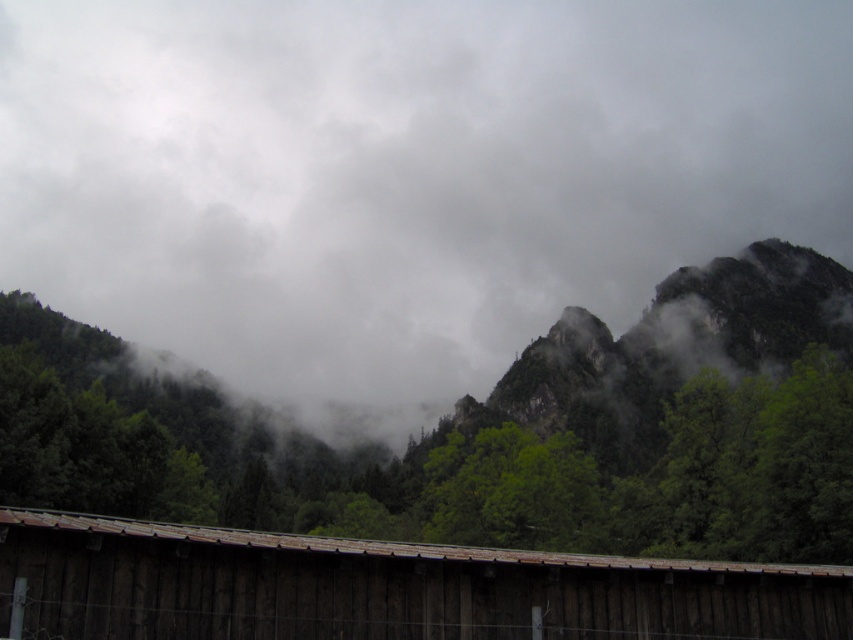
You are a hiker who wants to take a photo of the brown wooden hut at lower center without the green matte tree at center blocking the view. Is the tree too tall to block the hut in the photo?

The green matte tree at center is much taller than the brown wooden hut at lower center, so it might block the view of the hut in the photo.

You are standing at the origin point in the image. There are two points marked in the scene, point (189, 476) and point (827, 620). Which point is closer to you?

Point (827, 620) is closer to you because it is in front of point (189, 476).